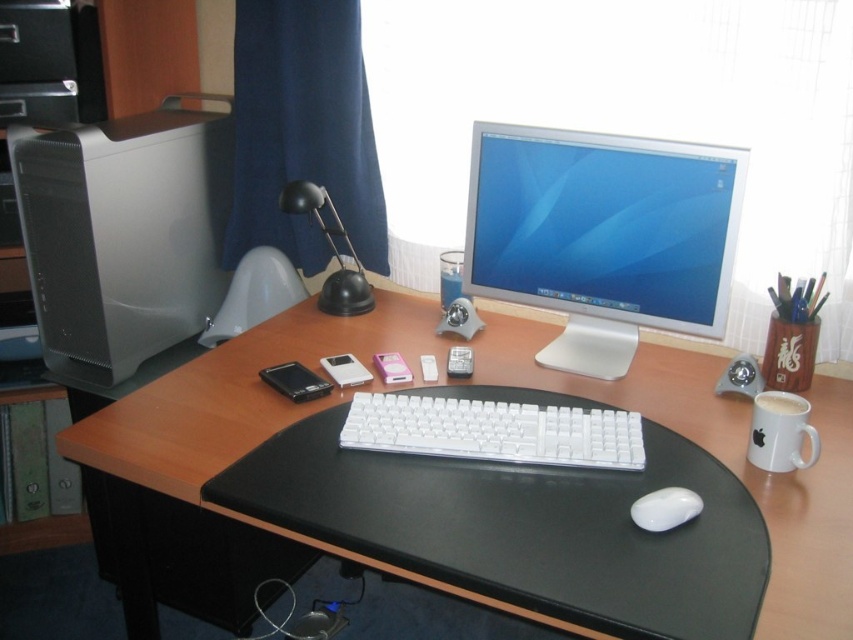
Between point (796, 436) and point (693, 497), which one is positioned in front?

Point (693, 497) is in front.

Find the location of a particular element. This screenshot has width=853, height=640. white ceramic mug at right is located at coordinates (780, 433).

Between point (511, 266) and point (369, 202), which one is positioned behind?

The point (369, 202) is more distant.

Between point (728, 292) and point (334, 1), which one is positioned in front?

Point (728, 292)

Find the location of a particular element. The image size is (853, 640). satin white monitor at center is located at coordinates (604, 225).

Does point (160, 480) come behind point (68, 161)?

No, (160, 480) is closer to viewer.

Does black leather mousepad at center have a smaller size compared to satin silver desktop computer at left?

Incorrect, black leather mousepad at center is not smaller in size than satin silver desktop computer at left.

Does point (706, 433) lie in front of point (181, 224)?

Yes, point (706, 433) is in front of point (181, 224).

At what (x,y) coordinates should I click in order to perform the action: click on black leather mousepad at center. Please return your answer as a coordinate pair (x, y). Image resolution: width=853 pixels, height=640 pixels. Looking at the image, I should click on (724, 461).